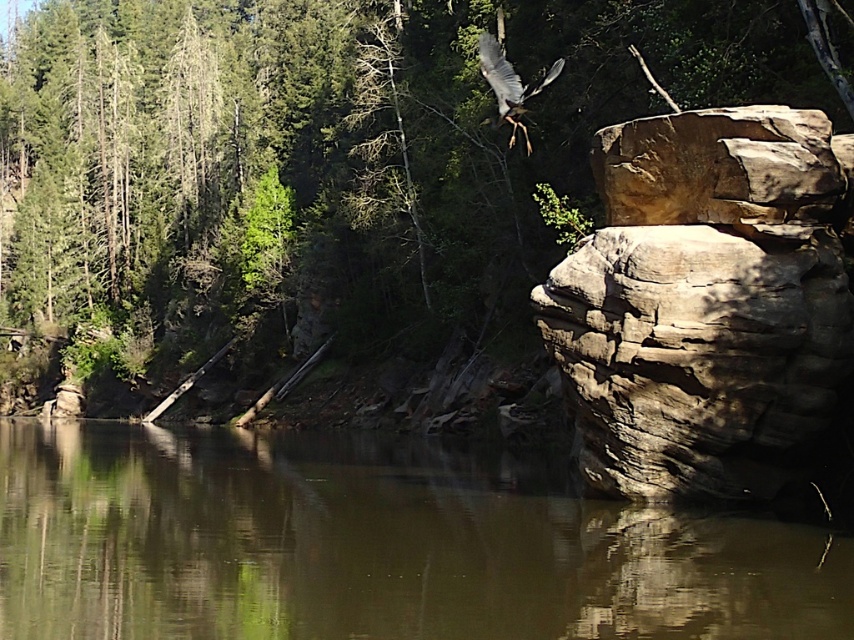
Who is lower down, green leafy tree at upper center or brown smooth water at center?

brown smooth water at center

Looking at this image, is green leafy tree at upper center bigger than brown smooth water at center?

Yes.

The width and height of the screenshot is (854, 640). I want to click on green leafy tree at upper center, so click(x=326, y=152).

In the scene shown: Who is positioned more to the right, green leafy tree at upper center or gray feathered bird at upper center?

Positioned to the right is gray feathered bird at upper center.

You are a GUI agent. You are given a task and a screenshot of the screen. Output one action in this format:
    pyautogui.click(x=<x>, y=<y>)
    Task: Click on the green leafy tree at upper center
    Image resolution: width=854 pixels, height=640 pixels.
    Given the screenshot: What is the action you would take?
    pyautogui.click(x=326, y=152)

At what (x,y) coordinates should I click in order to perform the action: click on green leafy tree at upper center. Please return your answer as a coordinate pair (x, y). Image resolution: width=854 pixels, height=640 pixels. Looking at the image, I should click on (326, 152).

Is green leafy tree at upper center closer to the viewer compared to brown rough rock at right?

That is False.

Can you confirm if green leafy tree at upper center is positioned to the left of brown rough rock at right?

Correct, you'll find green leafy tree at upper center to the left of brown rough rock at right.

Between point (174, 182) and point (624, 237), which one is positioned in front?

Point (624, 237)

You are a GUI agent. You are given a task and a screenshot of the screen. Output one action in this format:
    pyautogui.click(x=<x>, y=<y>)
    Task: Click on the green leafy tree at upper center
    
    Given the screenshot: What is the action you would take?
    tap(326, 152)